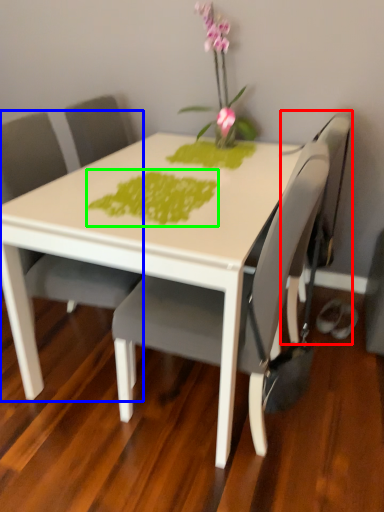
Question: Which object is the closest to the swivel chair (highlighted by a red box)? Choose among these: chair (highlighted by a blue box) or design (highlighted by a green box).

Choices:
 (A) chair
 (B) design

Answer: (B)